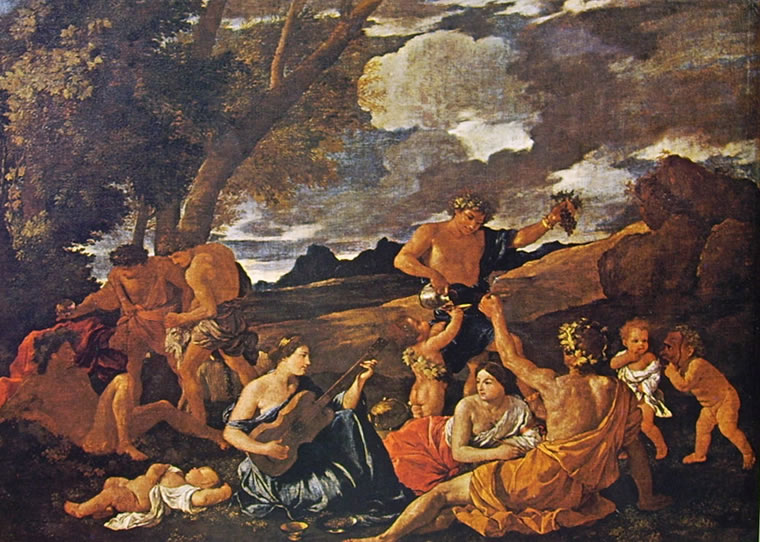
Find the location of a particular element. pitcher is located at coordinates (426, 294).